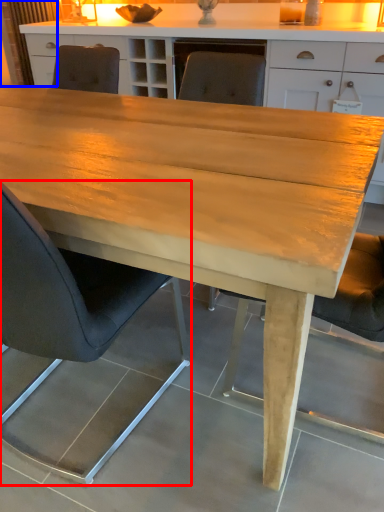
Question: Which point is further to the camera, chair (highlighted by a red box) or curtain (highlighted by a blue box)?

Choices:
 (A) chair
 (B) curtain

Answer: (B)